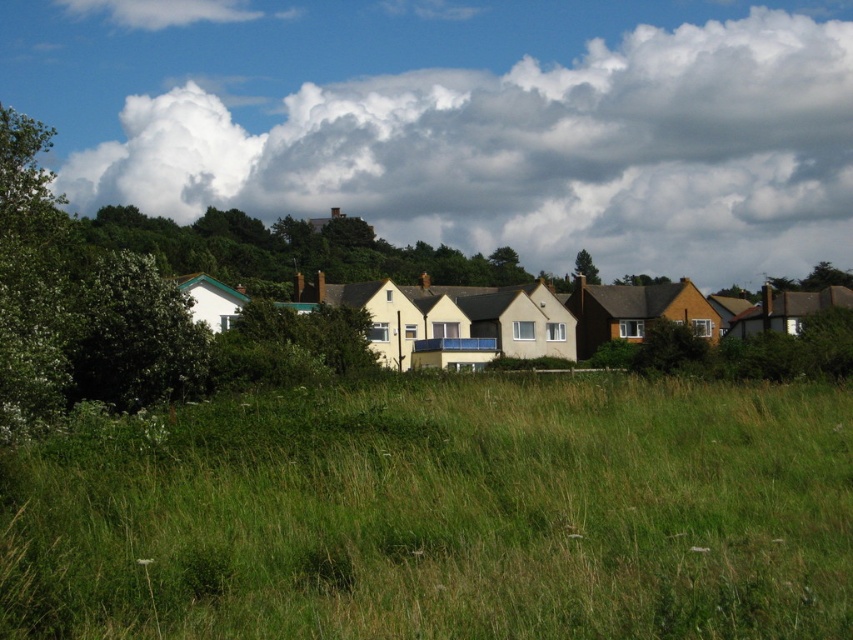
You are standing at the edge of the suburban landscape and want to find the green grass at center. According to the coordinates provided, in which direction should you look to locate it?

The green grass at center is located at coordinates 0.806 on the x axis and 0.524 on the y axis. Since the x coordinate is closer to 1, it is positioned towards the right side of the image, and the y coordinate is slightly above the center, so you should look towards the upper middle right direction to find it.

You are standing in the middle of the green grass at center and want to take a photo of the green leafy tree at center. Which direction should you face to ensure the tree is fully visible without any obstruction?

Since the green grass at center is in front of the green leafy tree at center, you should face away from the tree to avoid the grass obstructing the view. Alternatively, moving to a higher position might help, but based on the description, facing away from the tree would ensure it is visible without obstruction.